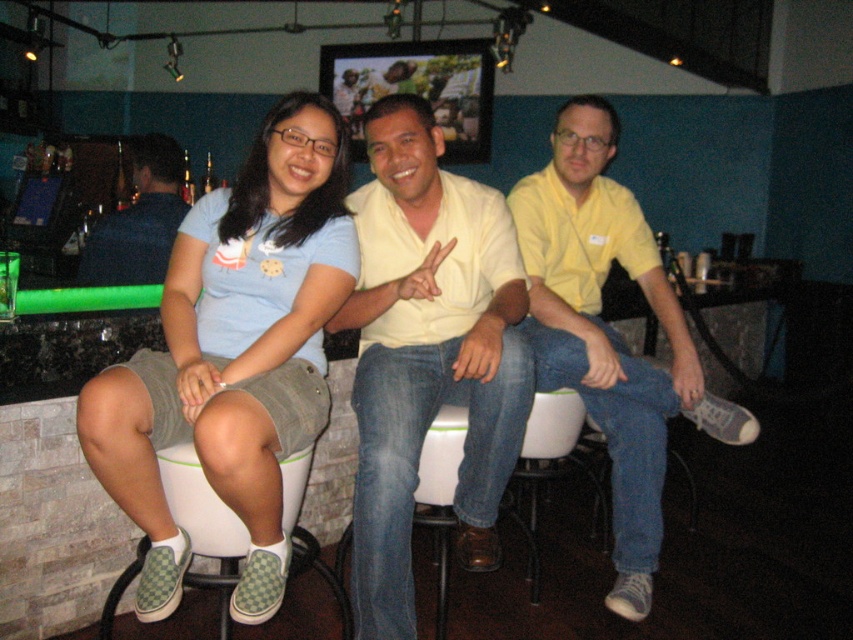
Question: Is light blue t-shirt at center bigger than matte yellow shirt at center?

Choices:
 (A) no
 (B) yes

Answer: (A)

Question: Which of the following is the farthest from the observer?

Choices:
 (A) (268, 544)
 (B) (614, 132)

Answer: (B)

Question: Which point appears farthest from the camera in this image?

Choices:
 (A) (399, 634)
 (B) (283, 170)
 (C) (171, 452)
 (D) (636, 282)

Answer: (D)

Question: Can you confirm if light blue t-shirt at center is wider than dark blue shirt at left?

Choices:
 (A) no
 (B) yes

Answer: (A)

Question: Does light blue t-shirt at center appear under matte yellow shirt at center?

Choices:
 (A) no
 (B) yes

Answer: (A)

Question: Among these points, which one is farthest from the camera?

Choices:
 (A) (392, 404)
 (B) (257, 291)

Answer: (B)